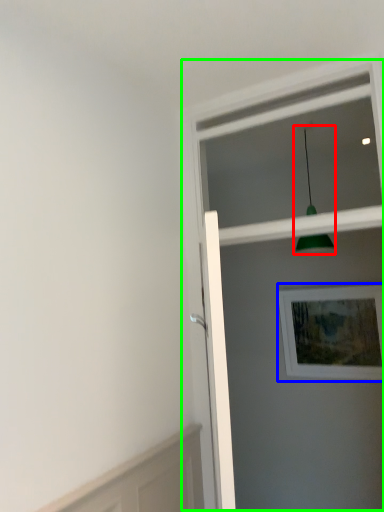
Question: Estimate the real-world distances between objects in this image. Which object is closer to light fixture (highlighted by a red box), picture frame (highlighted by a blue box) or screen door (highlighted by a green box)?

Choices:
 (A) picture frame
 (B) screen door

Answer: (A)